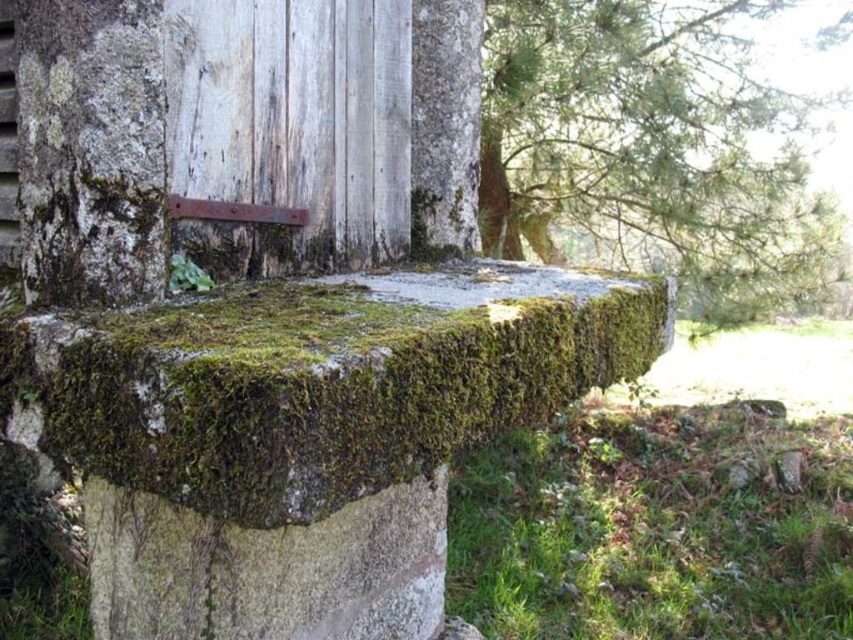
Consider the image. You are a gardener who wants to plant a new flower in the green mossy grass at lower right and the green mossy stump at upper right. Which location has a wider area to accommodate the flower?

The green mossy grass at lower right might be wider than green mossy stump at upper right, so it has a wider area to accommodate the flower.

You are an architect inspecting an old building site. You notice the green mossy stump at upper right and the white rough cement at lower center. Which of these two objects is larger in size?

The green mossy stump at upper right is bigger than the white rough cement at lower center, so the green mossy stump at upper right is larger in size.